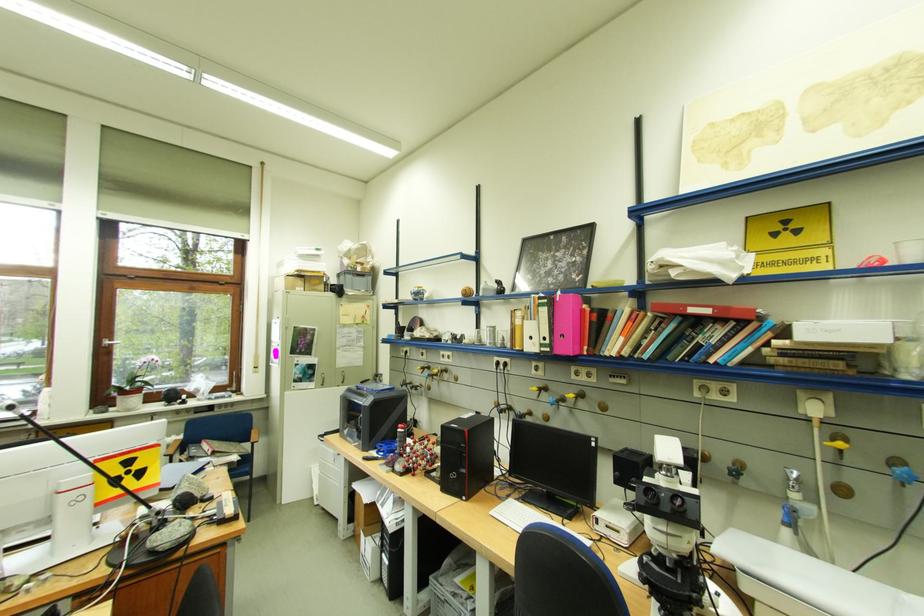
Describe the element at coordinates (128, 398) in the screenshot. The width and height of the screenshot is (924, 616). I see `the brown flower pot` at that location.